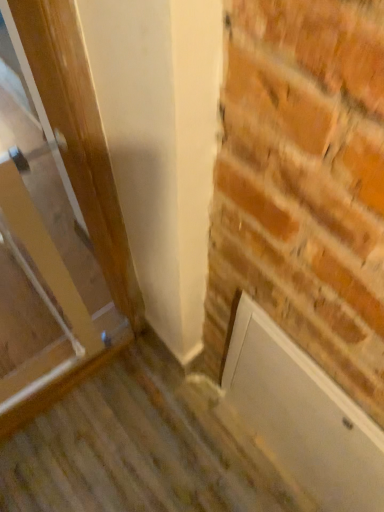
Question: From the image's perspective, is white matte door at lower right located beneath wooden door at left?

Choices:
 (A) no
 (B) yes

Answer: (B)

Question: From a real-world perspective, is white matte door at lower right beneath wooden door at left?

Choices:
 (A) no
 (B) yes

Answer: (B)

Question: Considering the relative sizes of white matte door at lower right and wooden door at left in the image provided, is white matte door at lower right taller than wooden door at left?

Choices:
 (A) no
 (B) yes

Answer: (A)

Question: Is the depth of white matte door at lower right greater than that of wooden door at left?

Choices:
 (A) yes
 (B) no

Answer: (A)

Question: From a real-world perspective, does white matte door at lower right stand above wooden door at left?

Choices:
 (A) yes
 (B) no

Answer: (B)

Question: Considering the relative positions of white matte door at lower right and wooden door at left in the image provided, is white matte door at lower right to the left of wooden door at left from the viewer's perspective?

Choices:
 (A) no
 (B) yes

Answer: (A)

Question: Is wooden door at left behind white matte door at lower right?

Choices:
 (A) yes
 (B) no

Answer: (B)

Question: Is the position of wooden door at left less distant than that of white matte door at lower right?

Choices:
 (A) yes
 (B) no

Answer: (A)

Question: Considering the relative sizes of wooden door at left and white matte door at lower right in the image provided, is wooden door at left shorter than white matte door at lower right?

Choices:
 (A) yes
 (B) no

Answer: (B)

Question: Is wooden door at left at the left side of white matte door at lower right?

Choices:
 (A) yes
 (B) no

Answer: (A)

Question: Is wooden door at left facing towards white matte door at lower right?

Choices:
 (A) yes
 (B) no

Answer: (B)

Question: Could white matte door at lower right be considered to be inside wooden door at left?

Choices:
 (A) no
 (B) yes

Answer: (A)

Question: Relative to white matte door at lower right, is wooden door at left in front or behind?

Choices:
 (A) behind
 (B) front

Answer: (B)